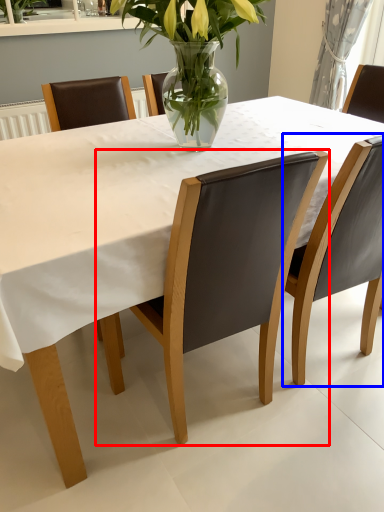
Question: Among these objects, which one is nearest to the camera, chair (highlighted by a red box) or chair (highlighted by a blue box)?

Choices:
 (A) chair
 (B) chair

Answer: (A)